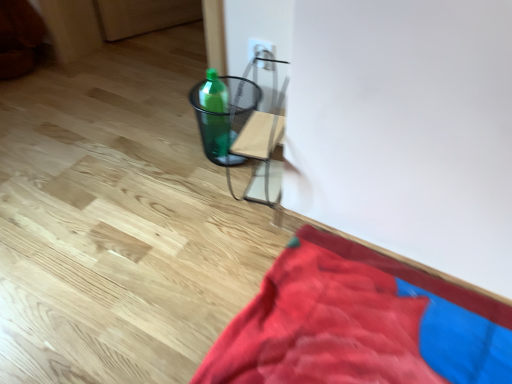
At what (x,y) coordinates should I click in order to perform the action: click on green plastic bottle at center. Please return your answer as a coordinate pair (x, y). Looking at the image, I should click on (215, 114).

You are a GUI agent. You are given a task and a screenshot of the screen. Output one action in this format:
    pyautogui.click(x=<x>, y=<y>)
    Task: Click on the white plastic electric outlet at upper center
    
    Given the screenshot: What is the action you would take?
    pyautogui.click(x=261, y=53)

Is green plastic bottle at center smaller than white plastic electric outlet at upper center?

Actually, green plastic bottle at center might be larger than white plastic electric outlet at upper center.

Is green plastic bottle at center not within white plastic electric outlet at upper center?

green plastic bottle at center lies outside white plastic electric outlet at upper center's area.

Is green plastic bottle at center taller than white plastic electric outlet at upper center?

Yes, green plastic bottle at center is taller than white plastic electric outlet at upper center.

The image size is (512, 384). Find the location of `bottle to the left of white plastic electric outlet at upper center`. bottle to the left of white plastic electric outlet at upper center is located at coordinates (215, 114).

Do you think velvet red blanket at lower right is within white plastic electric outlet at upper center, or outside of it?

The correct answer is: outside.

From the image's perspective, which one is positioned lower, velvet red blanket at lower right or white plastic electric outlet at upper center?

velvet red blanket at lower right appears lower in the image.

Is point (318, 325) closer or farther from the camera than point (255, 55)?

Point (318, 325) is positioned closer to the camera compared to point (255, 55).

Are velvet red blanket at lower right and white plastic electric outlet at upper center far apart?

No.

Is the position of velvet red blanket at lower right less distant than that of green plastic bottle at center?

Yes, the depth of velvet red blanket at lower right is less than that of green plastic bottle at center.

Considering the points (284, 365) and (217, 111), which point is in front, point (284, 365) or point (217, 111)?

The point (284, 365) is more forward.

Considering the sizes of objects velvet red blanket at lower right and green plastic bottle at center in the image provided, who is wider, velvet red blanket at lower right or green plastic bottle at center?

velvet red blanket at lower right is wider.

This screenshot has height=384, width=512. What are the coordinates of `bottle above the velvet red blanket at lower right (from a real-world perspective)` in the screenshot? It's located at (215, 114).

From the image's perspective, does white plastic electric outlet at upper center appear higher than velvet red blanket at lower right?

Indeed, from the image's perspective, white plastic electric outlet at upper center is shown above velvet red blanket at lower right.

Can you confirm if white plastic electric outlet at upper center is bigger than velvet red blanket at lower right?

Actually, white plastic electric outlet at upper center might be smaller than velvet red blanket at lower right.

Is white plastic electric outlet at upper center positioned behind velvet red blanket at lower right?

Yes, white plastic electric outlet at upper center is further from the camera.

Is white plastic electric outlet at upper center to the right of velvet red blanket at lower right from the viewer's perspective?

No.

Is point (250, 41) positioned before point (212, 108)?

No, it is behind (212, 108).

Consider the image. Considering the sizes of white plastic electric outlet at upper center and green plastic bottle at center in the image, is white plastic electric outlet at upper center wider or thinner than green plastic bottle at center?

Considering their sizes, white plastic electric outlet at upper center looks slimmer than green plastic bottle at center.

Which of these two, white plastic electric outlet at upper center or green plastic bottle at center, is bigger?

green plastic bottle at center.

Locate an element on the screen. This screenshot has height=384, width=512. electric outlet behind the green plastic bottle at center is located at coordinates (261, 53).

From the picture: Would you say green plastic bottle at center is inside or outside velvet red blanket at lower right?

green plastic bottle at center cannot be found inside velvet red blanket at lower right.

Which of these two, green plastic bottle at center or velvet red blanket at lower right, is thinner?

green plastic bottle at center.

From the image's perspective, which object appears higher, green plastic bottle at center or velvet red blanket at lower right?

green plastic bottle at center, from the image's perspective.

Between green plastic bottle at center and velvet red blanket at lower right, which one has more height?

green plastic bottle at center.

Image resolution: width=512 pixels, height=384 pixels. Find the location of `bottle in front of the white plastic electric outlet at upper center`. bottle in front of the white plastic electric outlet at upper center is located at coordinates (215, 114).

In the image, there is a velvet red blanket at lower right. At what (x,y) coordinates should I click in order to perform the action: click on electric outlet above it (from the image's perspective). Please return your answer as a coordinate pair (x, y). The width and height of the screenshot is (512, 384). Looking at the image, I should click on (261, 53).

When comparing their distances from velvet red blanket at lower right, does green plastic bottle at center or white plastic electric outlet at upper center seem further?

white plastic electric outlet at upper center is further to velvet red blanket at lower right.

Which object lies further to the anchor point green plastic bottle at center, velvet red blanket at lower right or white plastic electric outlet at upper center?

velvet red blanket at lower right.

In the scene shown: Estimate the real-world distances between objects in this image. Which object is further from green plastic bottle at center, white plastic electric outlet at upper center or velvet red blanket at lower right?

velvet red blanket at lower right lies further to green plastic bottle at center than the other object.

When comparing their distances from white plastic electric outlet at upper center, does green plastic bottle at center or velvet red blanket at lower right seem further?

The object further to white plastic electric outlet at upper center is velvet red blanket at lower right.

Considering their positions, is white plastic electric outlet at upper center positioned closer to velvet red blanket at lower right than green plastic bottle at center?

Based on the image, green plastic bottle at center appears to be nearer to velvet red blanket at lower right.

Based on their spatial positions, is velvet red blanket at lower right or green plastic bottle at center closer to white plastic electric outlet at upper center?

Among the two, green plastic bottle at center is located nearer to white plastic electric outlet at upper center.

At what (x,y) coordinates should I click in order to perform the action: click on bottle between white plastic electric outlet at upper center and velvet red blanket at lower right in the vertical direction. Please return your answer as a coordinate pair (x, y). This screenshot has width=512, height=384. Looking at the image, I should click on (215, 114).